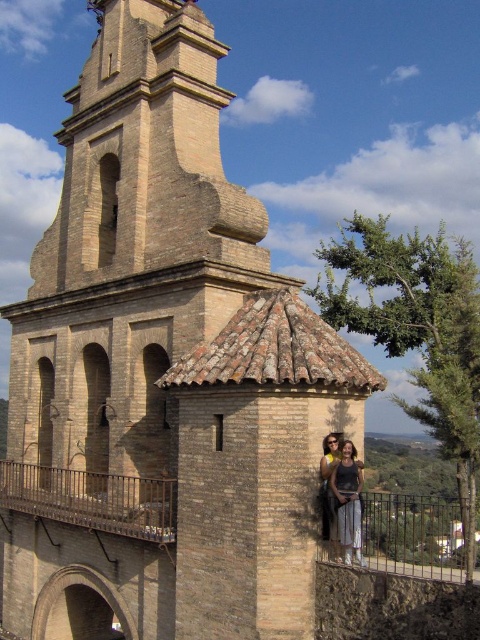
Question: Considering the relative positions of rustic metal railing at center and matte black dress at center in the image provided, where is rustic metal railing at center located with respect to matte black dress at center?

Choices:
 (A) below
 (B) above

Answer: (A)

Question: From the image, what is the correct spatial relationship of rustic metal railing at center in relation to matte black dress at center?

Choices:
 (A) left
 (B) right

Answer: (A)

Question: Is rustic metal railing at center to the left of matte black dress at center from the viewer's perspective?

Choices:
 (A) yes
 (B) no

Answer: (A)